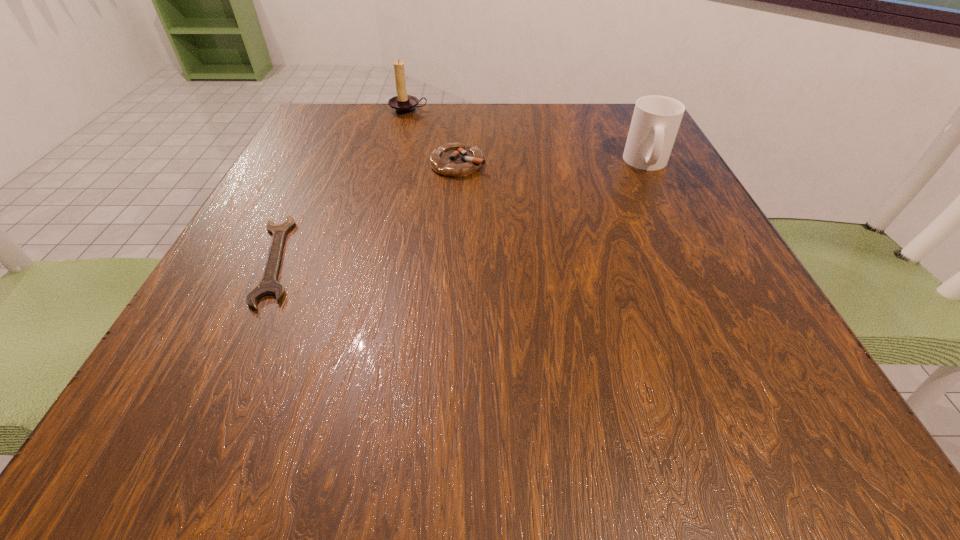
At what (x,y) coordinates should I click in order to perform the action: click on free space between the rightmost object and the third object from right to left. Please return your answer as a coordinate pair (x, y). The width and height of the screenshot is (960, 540). Looking at the image, I should click on 528,137.

Identify the location of blank region between the leftmost object and the second shortest object. (367, 212).

The height and width of the screenshot is (540, 960). Find the location of `empty location between the farthest object and the rightmost object`. empty location between the farthest object and the rightmost object is located at coordinates (528, 137).

Find the location of a particular element. The height and width of the screenshot is (540, 960). vacant region between the candle holder and the second shortest object is located at coordinates (433, 137).

Point out which object is positioned as the nearest to the shortest object. Please provide its 2D coordinates. Your answer should be formatted as a tuple, i.e. [(x, y)], where the tuple contains the x and y coordinates of a point satisfying the conditions above.

[(455, 160)]

The width and height of the screenshot is (960, 540). Identify the location of object that is the third nearest to the ashtray. (656, 119).

What are the coordinates of `free space that satisfies the following two spatial constraints: 1. on the wick of the third tallest object; 2. on the right side of the farthest object` in the screenshot? It's located at (395, 164).

I want to click on free spot that satisfies the following two spatial constraints: 1. on the back side of the wrench; 2. on the right side of the ashtray, so click(x=322, y=164).